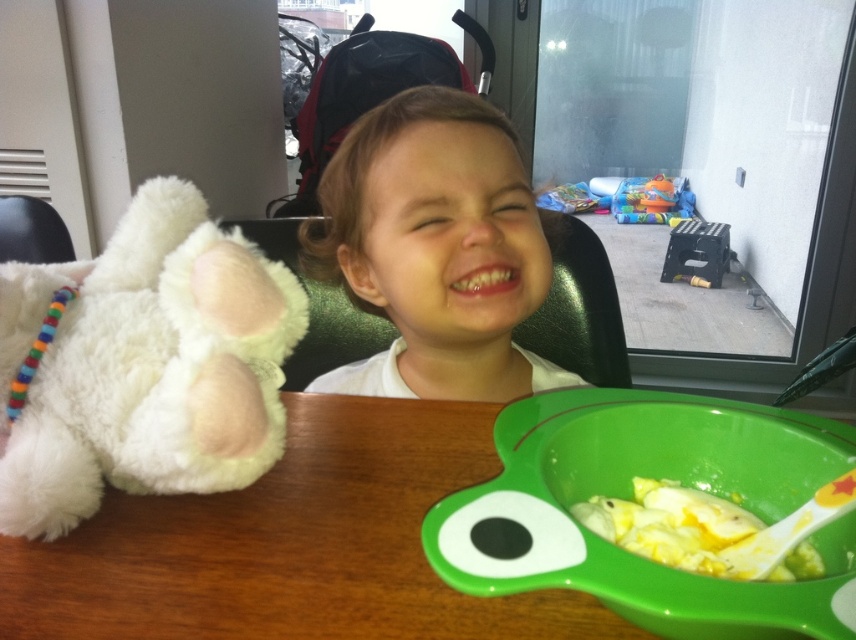
You are a parent trying to clean up after your child. You need to place a toy car in the green high chair. Is the toy car closer to the point marked at coordinates (628, 497) than to the green high chair?

The point marked at coordinates (628, 497) indicates the green plastic bowl at lower right. The toy car is placed in the green high chair, so it is closer to the green high chair than to the green plastic bowl at lower right.

You are a parent trying to place a 2.5 meter long blanket on the floor between the white fluffy teddy bear at left and the black plastic folding stool at lower right. Will the blanket cover the entire space between them?

The distance between the white fluffy teddy bear at left and the black plastic folding stool at lower right is 2.65 meters. Since the blanket is only 2.5 meters long, it will not be long enough to cover the entire space between them.

You are the parent of the child sitting in the green high chair. You want to place a new toy on the table so that it is directly to the right of the white fluffy teddy bear at left. Where should you place the new toy?

The white fluffy teddy bear at left is located at point (146,364). To place the new toy directly to the right of it, you should position it at a coordinate with the same y value and a higher x value than 0.570, such as (146,416).